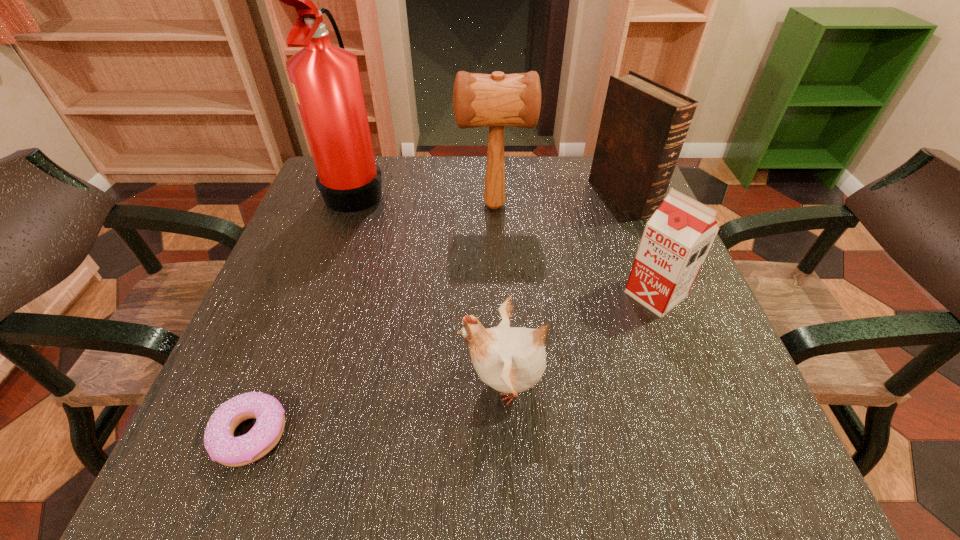
Identify the location of vacant space at the near edge. The height and width of the screenshot is (540, 960). (330, 429).

Where is `vacant space at the left edge of the desktop`? The image size is (960, 540). vacant space at the left edge of the desktop is located at coordinates (354, 246).

The image size is (960, 540). Find the location of `vacant space at the right edge of the desktop`. vacant space at the right edge of the desktop is located at coordinates (697, 293).

Where is `blank space at the far right corner`? blank space at the far right corner is located at coordinates (582, 172).

The height and width of the screenshot is (540, 960). In order to click on vacant point located between the fourth shortest object and the bird in this screenshot , I will do `click(564, 290)`.

This screenshot has width=960, height=540. I want to click on free space between the tallest object and the fifth tallest object, so click(430, 286).

Identify the location of free space that is in between the fifth tallest object and the Bible. The width and height of the screenshot is (960, 540). (564, 290).

Image resolution: width=960 pixels, height=540 pixels. Identify the location of vacant area that lies between the mallet and the third shortest object. (575, 250).

The image size is (960, 540). I want to click on vacant point located between the fire extinguisher and the soya milk, so click(x=506, y=241).

Image resolution: width=960 pixels, height=540 pixels. I want to click on free space between the fire extinguisher and the mallet, so click(425, 197).